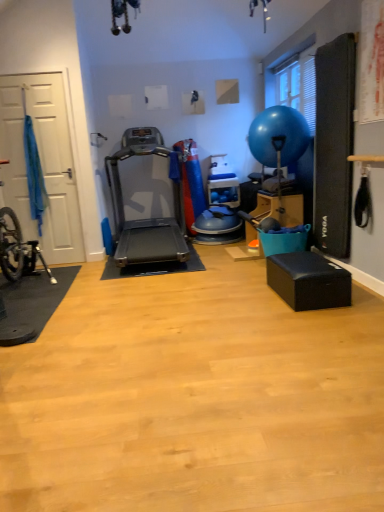
Question: In the image, is silver metallic treadmill at center positioned in front of or behind white matte door at left?

Choices:
 (A) behind
 (B) front

Answer: (B)

Question: Looking at their shapes, would you say silver metallic treadmill at center is wider or thinner than white matte door at left?

Choices:
 (A) wide
 (B) thin

Answer: (A)

Question: Estimate the real-world distances between objects in this image. Which object is farther from the white matte door at left?

Choices:
 (A) silver metallic treadmill at center
 (B) blue rubber balloon at upper right

Answer: (B)

Question: Estimate the real-world distances between objects in this image. Which object is closer to the white matte door at left?

Choices:
 (A) blue rubber balloon at upper right
 (B) silver metallic treadmill at center

Answer: (B)